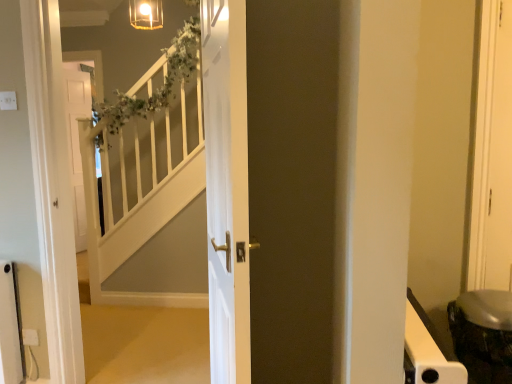
Question: Considering the positions of white glossy door at center and white plastic electric outlet at lower left in the image, is white glossy door at center wider or thinner than white plastic electric outlet at lower left?

Choices:
 (A) wide
 (B) thin

Answer: (A)

Question: Is white glossy door at center taller or shorter than white plastic electric outlet at lower left?

Choices:
 (A) short
 (B) tall

Answer: (B)

Question: Does point (234, 271) appear closer or farther from the camera than point (35, 337)?

Choices:
 (A) farther
 (B) closer

Answer: (B)

Question: Based on their sizes in the image, would you say white plastic electric outlet at lower left is bigger or smaller than white glossy door at center?

Choices:
 (A) small
 (B) big

Answer: (A)

Question: From the image's perspective, is white plastic electric outlet at lower left located above or below white glossy door at center?

Choices:
 (A) below
 (B) above

Answer: (A)

Question: In terms of height, does white plastic electric outlet at lower left look taller or shorter compared to white glossy door at center?

Choices:
 (A) tall
 (B) short

Answer: (B)

Question: Is white plastic electric outlet at lower left inside the boundaries of white glossy door at center, or outside?

Choices:
 (A) outside
 (B) inside

Answer: (A)